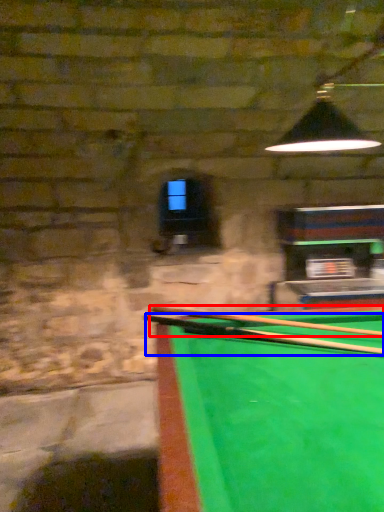
Question: Which of the following is the closest to the observer, cue (highlighted by a red box) or cue (highlighted by a blue box)?

Choices:
 (A) cue
 (B) cue

Answer: (B)